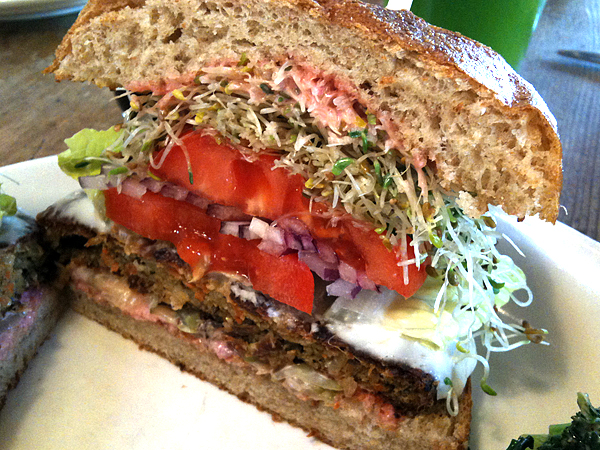
You are a GUI agent. You are given a task and a screenshot of the screen. Output one action in this format:
    pyautogui.click(x=<x>, y=<y>)
    Task: Click on the table
    This screenshot has width=600, height=450.
    Given the screenshot: What is the action you would take?
    [x=573, y=84]